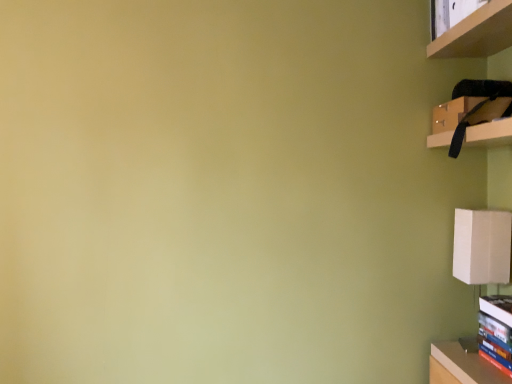
Question: From the image's perspective, is wooden shelf at upper right positioned above or below hardcover book at lower right?

Choices:
 (A) below
 (B) above

Answer: (B)

Question: Considering the positions of point (484, 26) and point (503, 329), is point (484, 26) closer or farther from the camera than point (503, 329)?

Choices:
 (A) closer
 (B) farther

Answer: (A)

Question: Which object is the farthest from the wooden shelf at upper right?

Choices:
 (A) matte black cabinet at upper right
 (B) hardcover book at lower right

Answer: (B)

Question: Which object is positioned farthest from the matte black cabinet at upper right?

Choices:
 (A) wooden shelf at upper right
 (B) hardcover book at lower right

Answer: (B)